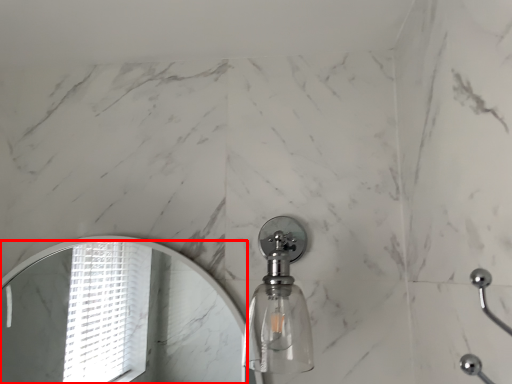
Question: From the image's perspective, where is mirror (annotated by the red box) located relative to soap dispenser?

Choices:
 (A) below
 (B) above

Answer: (A)